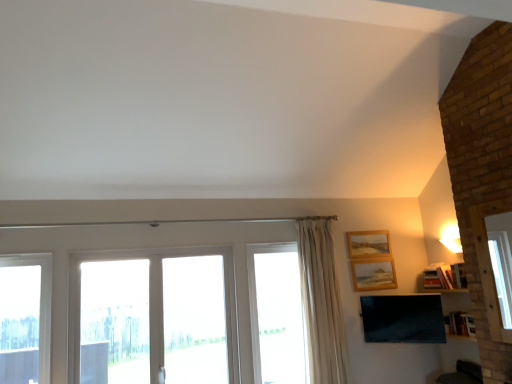
Question: Is transparent glass screen door at center to the left or to the right of beige fabric curtain at center in the image?

Choices:
 (A) right
 (B) left

Answer: (B)

Question: Is point (194, 294) closer or farther from the camera than point (320, 350)?

Choices:
 (A) farther
 (B) closer

Answer: (B)

Question: Which object is the farthest from the matte black tv at lower right?

Choices:
 (A) wooden picture frame at upper right, marked as the 1th picture frame in a bottom-to-top arrangement
 (B) transparent glass door at center, the 2th window when ordered from right to left
 (C) beige fabric curtain at center
 (D) wooden picture frame at upper right, which appears as the second picture frame when ordered from the bottom
 (E) clear glass window at center, arranged as the 1th window when viewed from the right

Answer: (B)

Question: Which object is positioned closest to the wooden picture frame at upper right, marked as the 1th picture frame in a bottom-to-top arrangement?

Choices:
 (A) transparent glass screen door at center
 (B) clear glass window at center, arranged as the 1th window when viewed from the right
 (C) matte black tv at lower right
 (D) wooden picture frame at upper right, which appears as the second picture frame when ordered from the bottom
 (E) transparent glass door at center, the 2th window when ordered from right to left

Answer: (D)